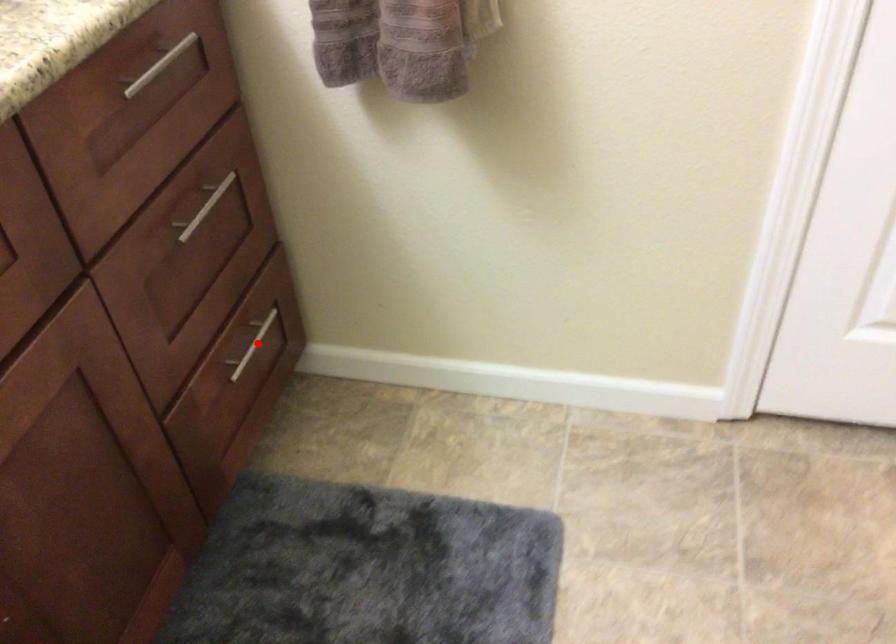
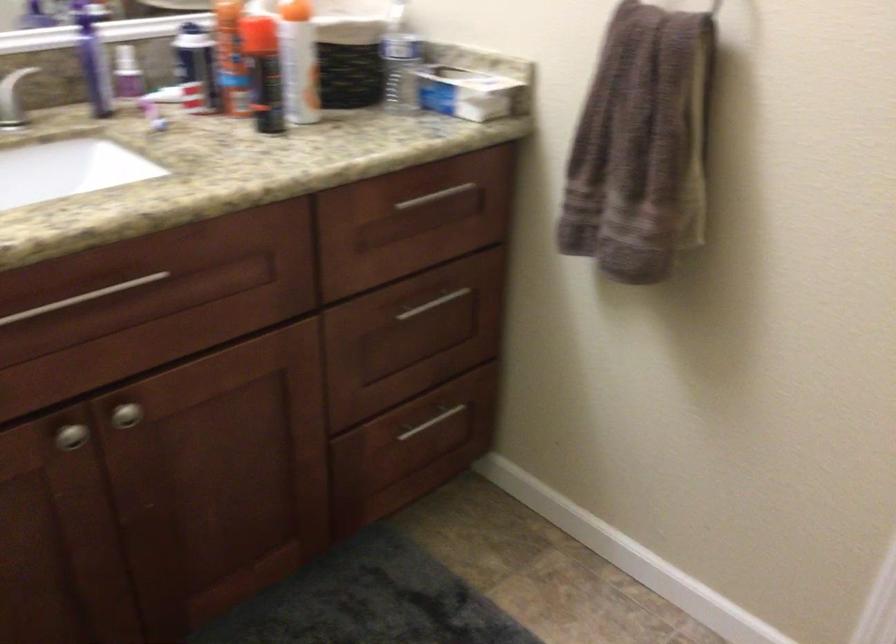
Question: I am providing you with two images of the same scene from different viewpoints. In image1, a red point is highlighted. Considering the same 3D point in image2, which of the following is correct?

Choices:
 (A) It is closer
 (B) It is farther

Answer: (B)